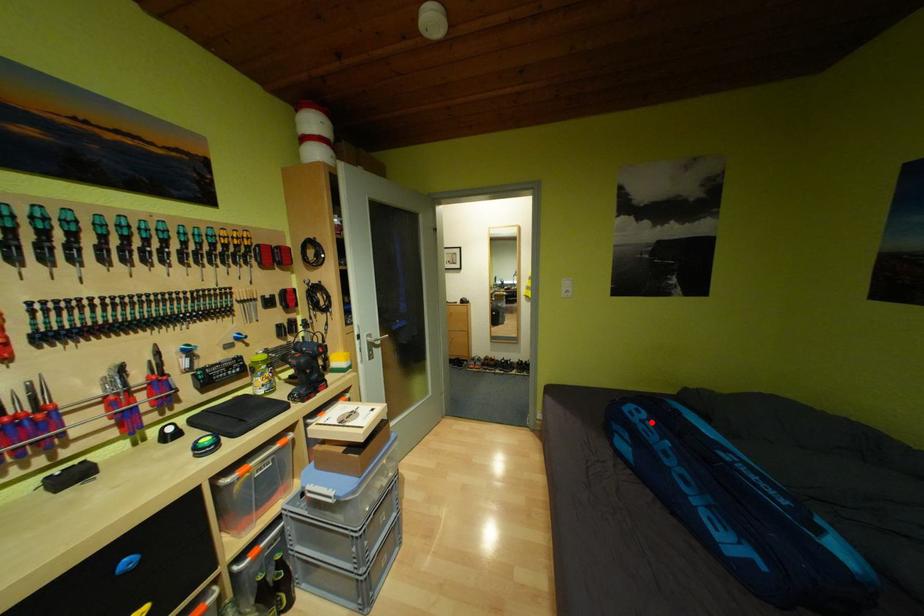
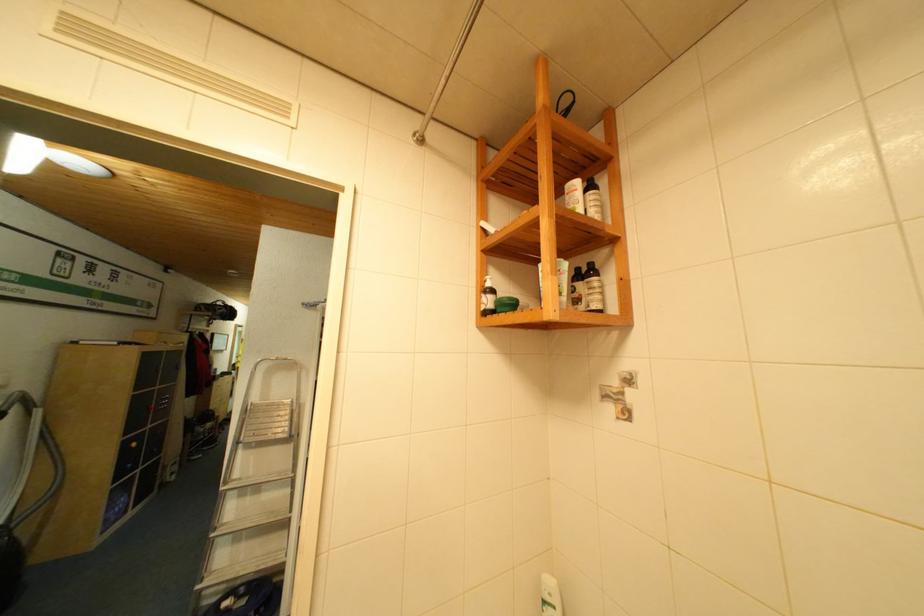
Question: I am providing you with two images of the same scene from different viewpoints. A red point is marked on the first image. Can you still see the location of the red point in image 2?

Choices:
 (A) Yes
 (B) No

Answer: (B)